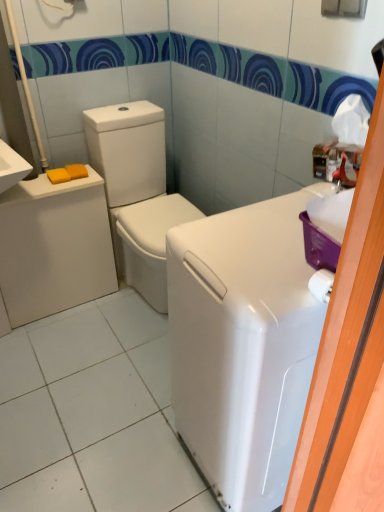
At what (x,y) coordinates should I click in order to perform the action: click on free space that is to the left of yellow matte soap at left, which is counted as the 2th soap, starting from the left. Please return your answer as a coordinate pair (x, y). Looking at the image, I should click on (37, 182).